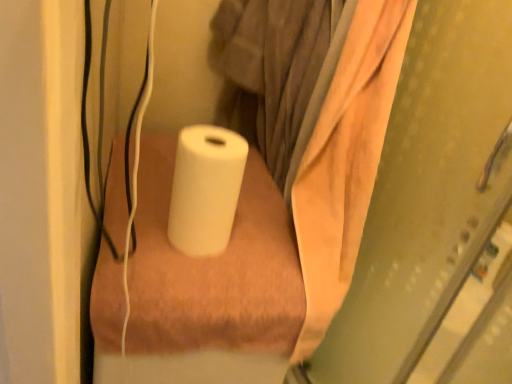
What are the coordinates of `vacant area located to the right-hand side of white matte paper towel at center` in the screenshot? It's located at (264, 248).